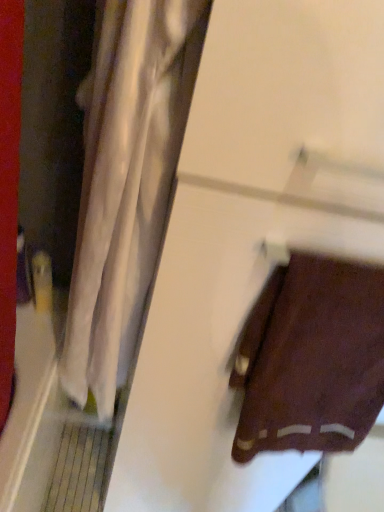
Locate an element on the screen. brown fabric towel at lower right is located at coordinates (311, 359).

The height and width of the screenshot is (512, 384). Describe the element at coordinates (311, 359) in the screenshot. I see `brown fabric towel at lower right` at that location.

Where is `white sheer curtain at left`? The height and width of the screenshot is (512, 384). white sheer curtain at left is located at coordinates point(126,185).

Describe the element at coordinates (126, 185) in the screenshot. This screenshot has width=384, height=512. I see `white sheer curtain at left` at that location.

Locate an element on the screen. brown fabric towel at lower right is located at coordinates (311, 359).

Considering the positions of objects white sheer curtain at left and brown fabric towel at lower right in the image provided, who is more to the left, white sheer curtain at left or brown fabric towel at lower right?

white sheer curtain at left.

Does white sheer curtain at left lie behind brown fabric towel at lower right?

No, white sheer curtain at left is closer to the camera.

Considering the positions of points (90, 229) and (362, 410), is point (90, 229) farther from camera compared to point (362, 410)?

No, (90, 229) is closer to viewer.

From the image's perspective, which one is positioned higher, white sheer curtain at left or brown fabric towel at lower right?

white sheer curtain at left.

From a real-world perspective, is white sheer curtain at left positioned over brown fabric towel at lower right based on gravity?

Yes.

Does white sheer curtain at left have a greater width compared to brown fabric towel at lower right?

Correct, the width of white sheer curtain at left exceeds that of brown fabric towel at lower right.

Which of these two, white sheer curtain at left or brown fabric towel at lower right, stands shorter?

brown fabric towel at lower right is shorter.

From the picture: Who is bigger, white sheer curtain at left or brown fabric towel at lower right?

Bigger between the two is white sheer curtain at left.

Which is correct: white sheer curtain at left is inside brown fabric towel at lower right, or outside of it?

white sheer curtain at left exists outside the volume of brown fabric towel at lower right.

Are white sheer curtain at left and brown fabric towel at lower right located far from each other?

No, white sheer curtain at left is in close proximity to brown fabric towel at lower right.

Is white sheer curtain at left looking in the opposite direction of brown fabric towel at lower right?

white sheer curtain at left is not turned away from brown fabric towel at lower right.

The width and height of the screenshot is (384, 512). I want to click on towel located below the white sheer curtain at left (from the image's perspective), so click(311, 359).

Based on their positions, is brown fabric towel at lower right located to the left or right of white sheer curtain at left?

From the image, it's evident that brown fabric towel at lower right is to the right of white sheer curtain at left.

Is brown fabric towel at lower right behind white sheer curtain at left?

Yes, it is.

Which is in front, point (327, 319) or point (120, 374)?

The point (327, 319) is more forward.

Consider the image. From the image's perspective, which one is positioned lower, brown fabric towel at lower right or white sheer curtain at left?

brown fabric towel at lower right.

From a real-world perspective, which object stands above the other?

A: white sheer curtain at left.

In the scene shown: Is brown fabric towel at lower right wider than white sheer curtain at left?

In fact, brown fabric towel at lower right might be narrower than white sheer curtain at left.

Can you confirm if brown fabric towel at lower right is taller than white sheer curtain at left?

No.

Does brown fabric towel at lower right have a smaller size compared to white sheer curtain at left?

Yes, brown fabric towel at lower right is smaller than white sheer curtain at left.

Is white sheer curtain at left surrounded by brown fabric towel at lower right?

That's incorrect, white sheer curtain at left is not inside brown fabric towel at lower right.

Are brown fabric towel at lower right and white sheer curtain at left beside each other?

No.

Does brown fabric towel at lower right turn towards white sheer curtain at left?

No, brown fabric towel at lower right is not oriented towards white sheer curtain at left.

How far apart are brown fabric towel at lower right and white sheer curtain at left?

12.13 inches.

Locate an element on the screen. Image resolution: width=384 pixels, height=512 pixels. curtain located on the left of brown fabric towel at lower right is located at coordinates (126, 185).

The width and height of the screenshot is (384, 512). I want to click on towel below the white sheer curtain at left (from the image's perspective), so click(x=311, y=359).

Where is `towel behind the white sheer curtain at left`? Image resolution: width=384 pixels, height=512 pixels. towel behind the white sheer curtain at left is located at coordinates (311, 359).